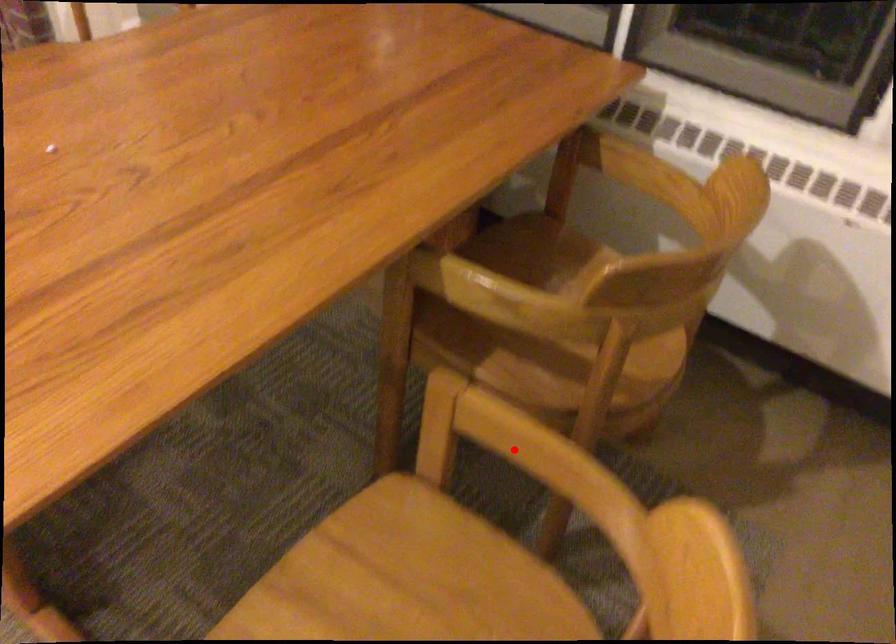
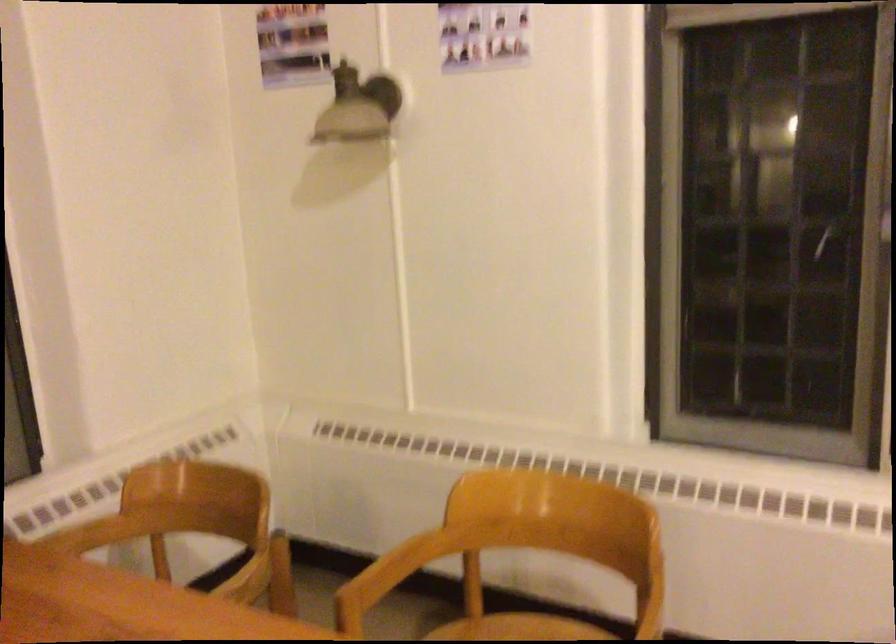
Locate, in the second image, the point that corresponds to the highlighted location in the first image.

(389, 574)